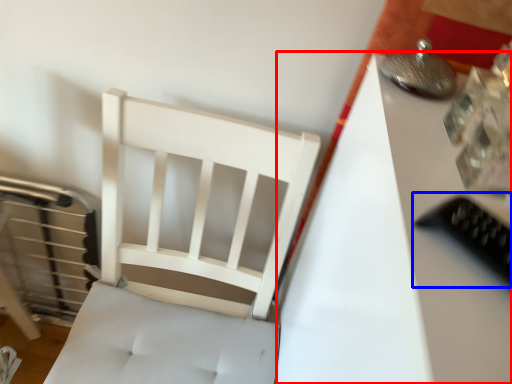
Question: Which point is closer to the camera, table (highlighted by a red box) or equipment (highlighted by a blue box)?

Choices:
 (A) table
 (B) equipment

Answer: (B)